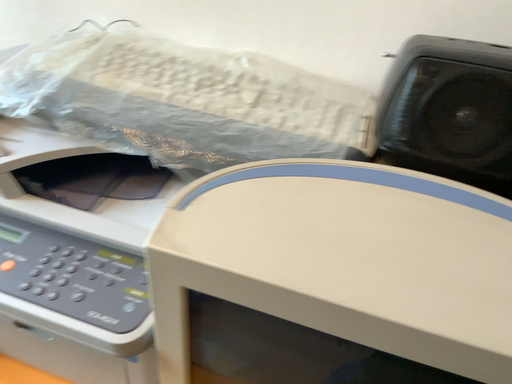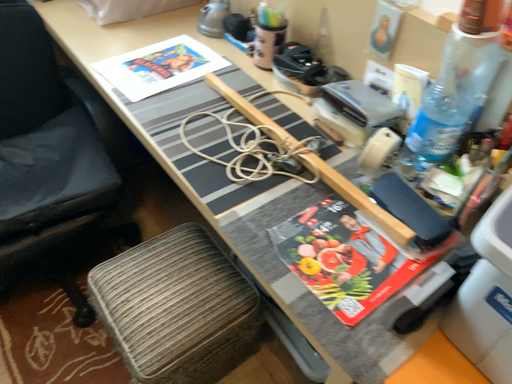
Question: How did the camera likely rotate when shooting the video?

Choices:
 (A) rotated right
 (B) rotated left

Answer: (B)